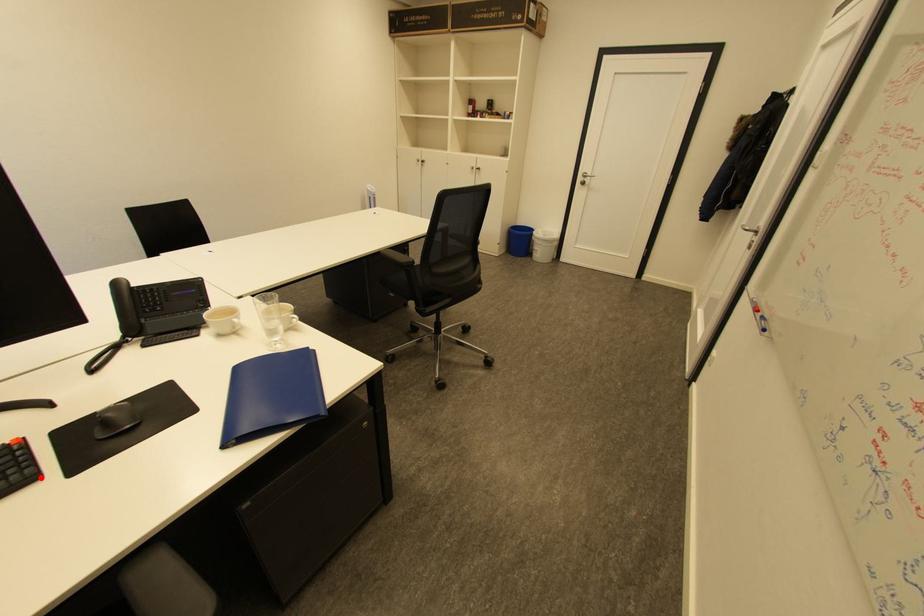
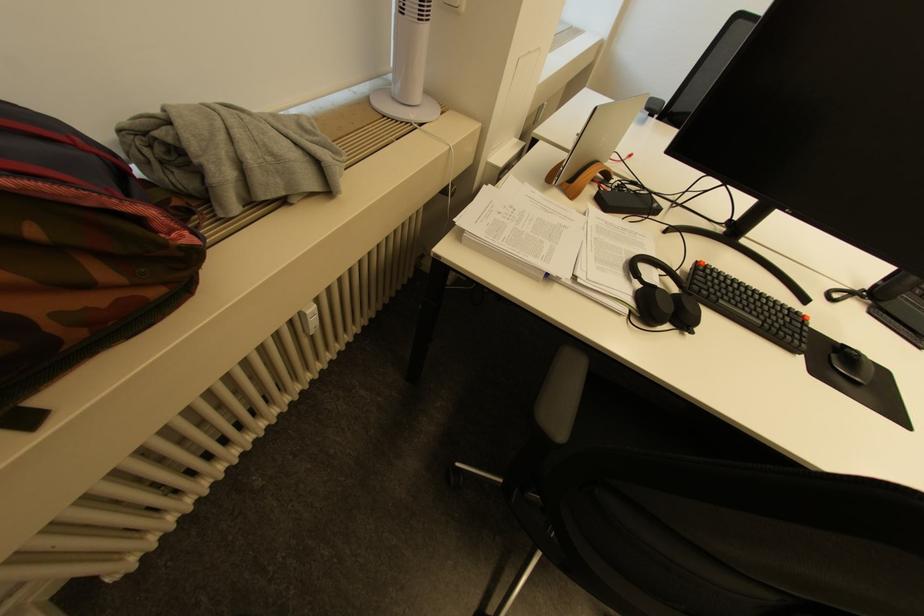
The point at the highlighted location is marked in the first image. Where is the corresponding point in the second image?

(800, 351)